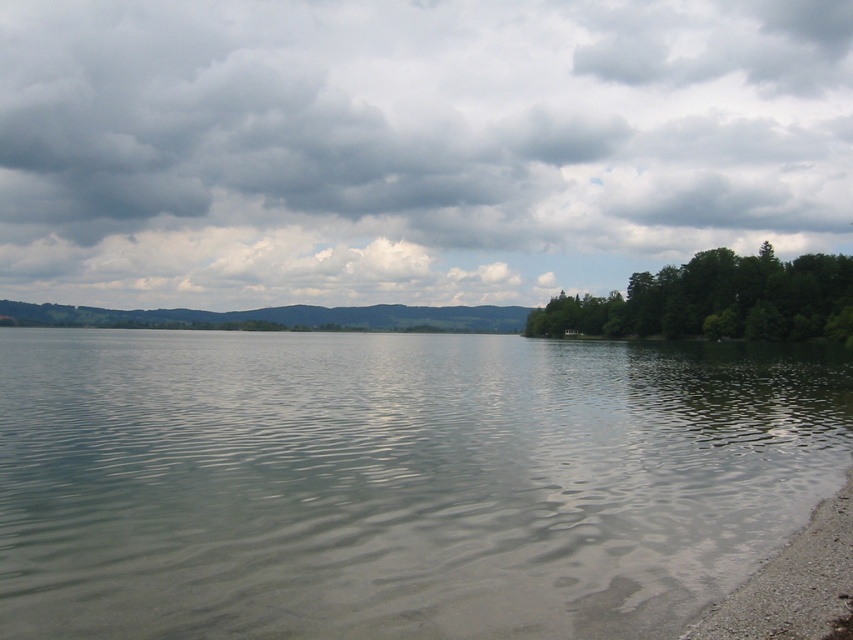
Does clear water at lower right have a lesser width compared to gray gravel shoreline at lower right?

No, clear water at lower right is not thinner than gray gravel shoreline at lower right.

Can you confirm if clear water at lower right is positioned above gray gravel shoreline at lower right?

Correct, clear water at lower right is located above gray gravel shoreline at lower right.

Is point (257, 424) positioned in front of point (849, 625)?

No, (257, 424) is further to viewer.

I want to click on clear water at lower right, so click(x=398, y=481).

Can you confirm if green leafy trees at right is positioned below gray gravel shoreline at lower right?

Actually, green leafy trees at right is above gray gravel shoreline at lower right.

Locate an element on the screen. The width and height of the screenshot is (853, 640). green leafy trees at right is located at coordinates (717, 300).

Between clear water at lower right and cloudy sky at upper center, which one is positioned higher?

cloudy sky at upper center is above.

Find the location of a particular element. The image size is (853, 640). clear water at lower right is located at coordinates point(398,481).